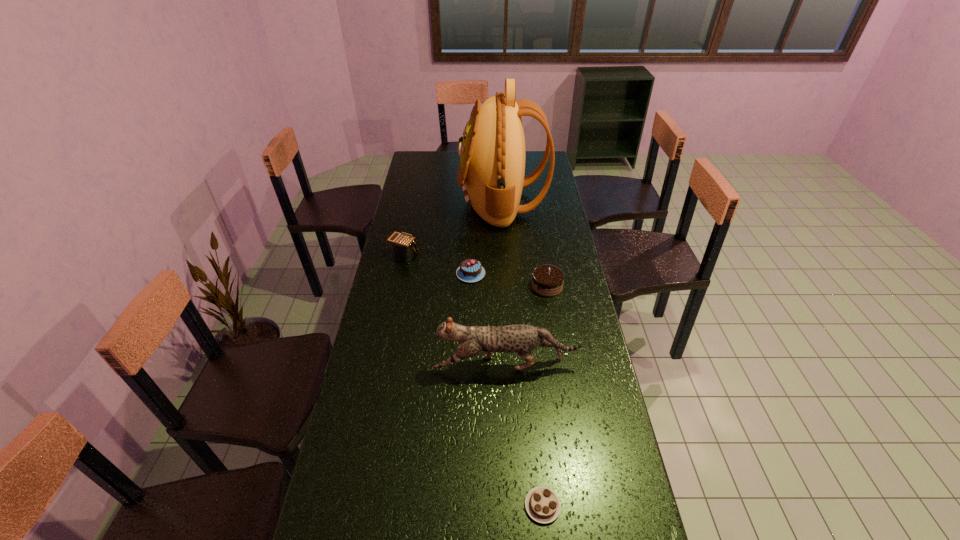
Locate an element on the screen. Image resolution: width=960 pixels, height=540 pixels. backpack is located at coordinates (491, 171).

Where is `the farthest object`? the farthest object is located at coordinates click(x=491, y=171).

This screenshot has height=540, width=960. In order to click on the second tallest object in this screenshot , I will do `click(522, 339)`.

Find the location of a particular element. The image size is (960, 540). the fifth farthest object is located at coordinates (522, 339).

Where is `the tallest chocolate cake`? The height and width of the screenshot is (540, 960). the tallest chocolate cake is located at coordinates (547, 280).

The width and height of the screenshot is (960, 540). I want to click on calculator, so click(x=403, y=245).

Find the location of a particular element. This screenshot has height=540, width=960. the fifth nearest object is located at coordinates (403, 245).

Locate an element on the screen. This screenshot has width=960, height=540. the second tallest chocolate cake is located at coordinates (470, 270).

Locate an element on the screen. The width and height of the screenshot is (960, 540). the second shortest object is located at coordinates 470,270.

At what (x,y) coordinates should I click in order to perform the action: click on the nearest object. Please return your answer as a coordinate pair (x, y). This screenshot has height=540, width=960. Looking at the image, I should click on (542, 504).